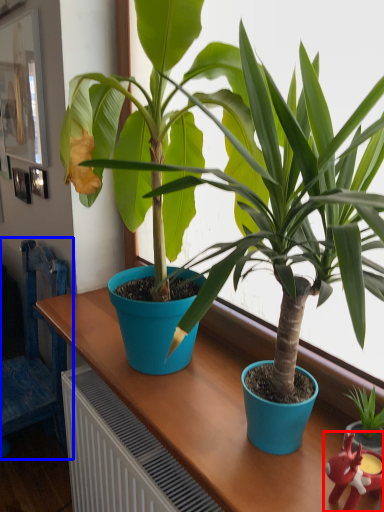
Question: Which object is further to the camera taking this photo, toy (highlighted by a red box) or chair (highlighted by a blue box)?

Choices:
 (A) toy
 (B) chair

Answer: (B)